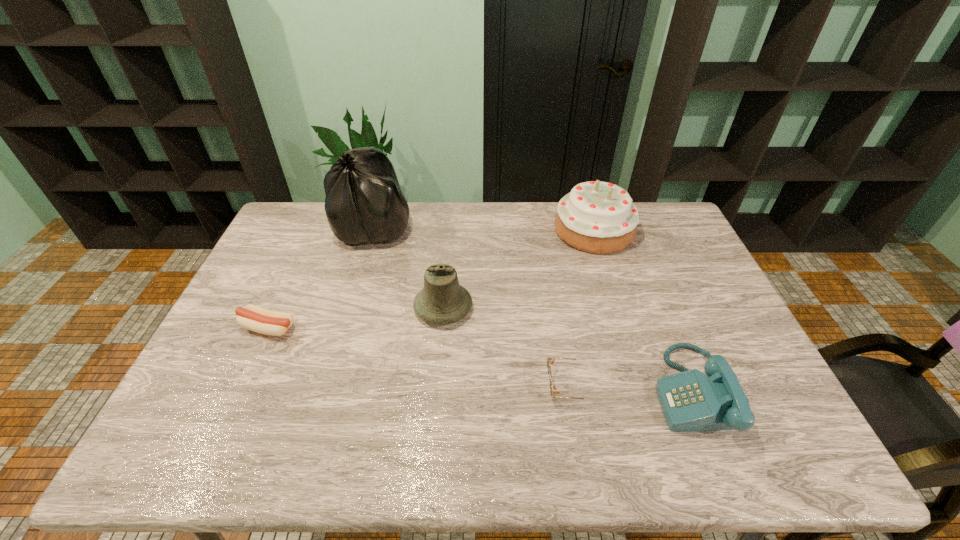
You are a GUI agent. You are given a task and a screenshot of the screen. Output one action in this format:
    pyautogui.click(x=<x>, y=<y>)
    Task: Click on the object that is at the left edge
    This screenshot has width=960, height=540.
    Given the screenshot: What is the action you would take?
    pyautogui.click(x=254, y=318)

Image resolution: width=960 pixels, height=540 pixels. Find the location of `object that is at the right edge`. object that is at the right edge is located at coordinates (690, 400).

This screenshot has height=540, width=960. In order to click on object that is positioned at the near right corner in this screenshot , I will do `click(690, 400)`.

The image size is (960, 540). Identify the location of free region at the far edge of the desktop. coord(432,208).

Find the location of a particular element. free space at the near edge of the desktop is located at coordinates (460, 449).

This screenshot has height=540, width=960. What are the coordinates of `vacant area at the far left corner` in the screenshot? It's located at (300, 219).

In the image, there is a desktop. Identify the location of blank space at the far right corner. This screenshot has width=960, height=540. (680, 226).

You are a GUI agent. You are given a task and a screenshot of the screen. Output one action in this format:
    pyautogui.click(x=<x>, y=<y>)
    Task: Click on the free space at the near right corner of the desktop
    This screenshot has width=960, height=540.
    Given the screenshot: What is the action you would take?
    pyautogui.click(x=781, y=466)

At what (x,y) coordinates should I click in order to perform the action: click on free space between the telephone and the sausage. Please return your answer as a coordinate pair (x, y). The width and height of the screenshot is (960, 540). Looking at the image, I should click on (480, 359).

At what (x,y) coordinates should I click in order to perform the action: click on vacant point located between the sausage and the sunglasses. Please return your answer as a coordinate pair (x, y). Image resolution: width=960 pixels, height=540 pixels. Looking at the image, I should click on (418, 356).